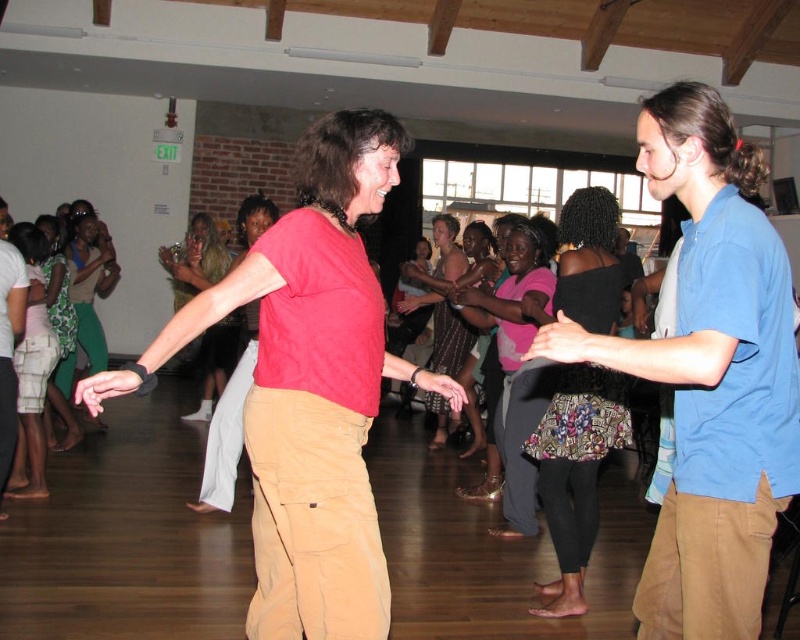
Does patterned fabric dress at center have a lesser width compared to matte red shirt at center?

No, patterned fabric dress at center is not thinner than matte red shirt at center.

Is patterned fabric dress at center below matte red shirt at center?

No.

Between point (404, 269) and point (194, 420), which one is positioned in front?

Point (404, 269) is more forward.

Where is `patterned fabric dress at center`? This screenshot has width=800, height=640. patterned fabric dress at center is located at coordinates (450, 289).

Is khaki pants at right shorter than patterned fabric dress at center?

Correct, khaki pants at right is not as tall as patterned fabric dress at center.

Is khaki pants at right bigger than patterned fabric dress at center?

No, khaki pants at right is not bigger than patterned fabric dress at center.

Does point (782, 339) come farther from viewer compared to point (450, 330)?

No, it is in front of (450, 330).

The image size is (800, 640). I want to click on khaki pants at right, so click(x=710, y=376).

Image resolution: width=800 pixels, height=640 pixels. I want to click on matte red shirt at center, so click(x=196, y=259).